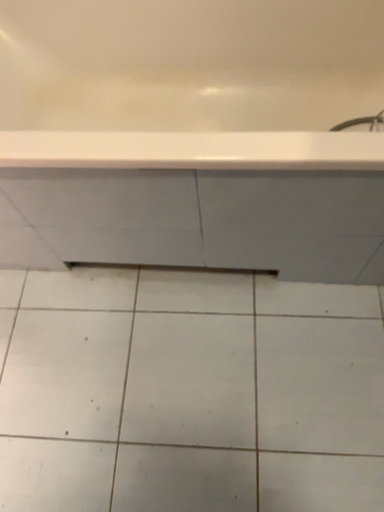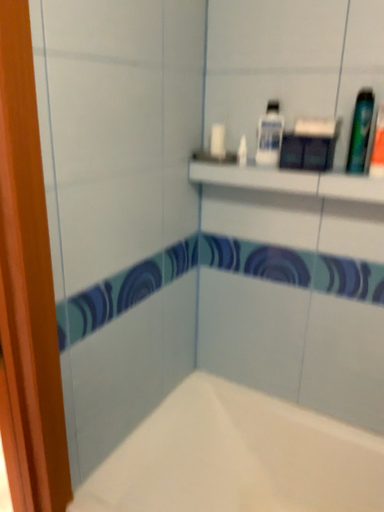
Question: Which way did the camera rotate in the video?

Choices:
 (A) rotated left
 (B) rotated right

Answer: (A)